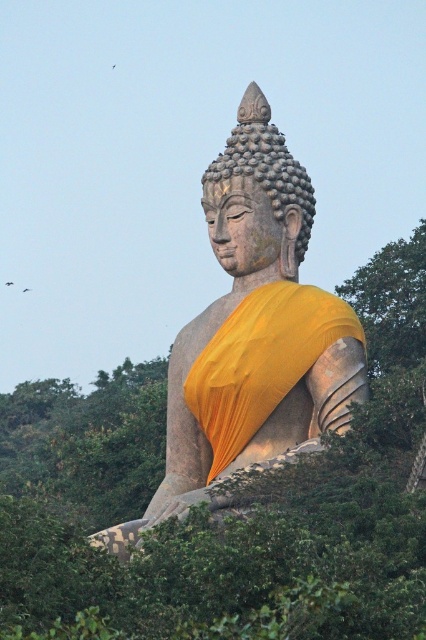
Question: Is stone statue at center bigger than matte stone buddha head at center?

Choices:
 (A) yes
 (B) no

Answer: (A)

Question: Which of the following is the closest to the observer?

Choices:
 (A) green leafy tree at center
 (B) matte stone buddha head at center
 (C) stone statue at center

Answer: (A)

Question: Which of the following is the closest to the observer?

Choices:
 (A) (37, 500)
 (B) (275, 416)
 (C) (256, 161)

Answer: (B)

Question: From the image, what is the correct spatial relationship of green leafy tree at center in relation to stone statue at center?

Choices:
 (A) below
 (B) above

Answer: (A)

Question: Can you confirm if stone statue at center is positioned to the right of matte stone buddha head at center?

Choices:
 (A) no
 (B) yes

Answer: (A)

Question: Based on their relative distances, which object is nearer to the green leafy tree at center?

Choices:
 (A) stone statue at center
 (B) matte stone buddha head at center

Answer: (A)